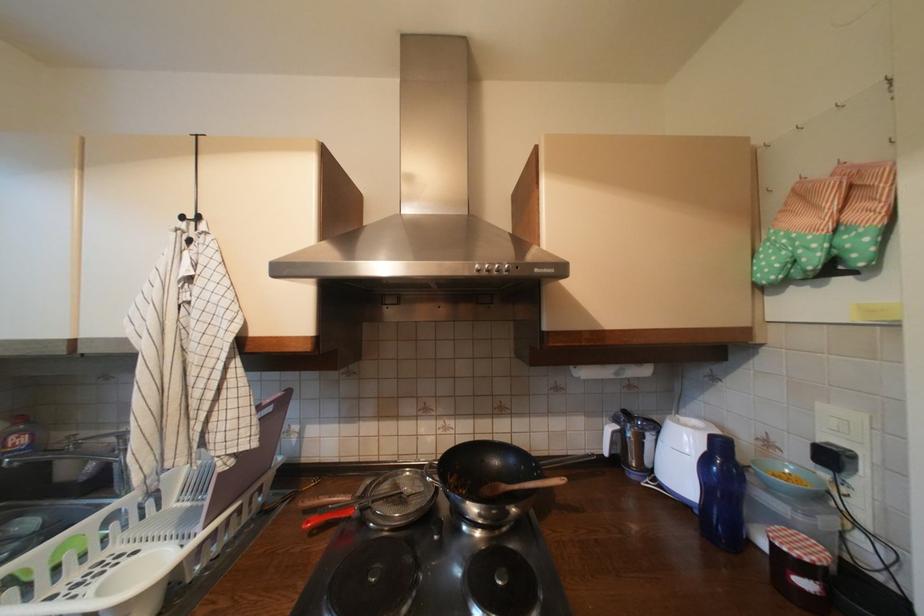
The height and width of the screenshot is (616, 924). Find the location of `green oven mitt`. green oven mitt is located at coordinates (x=800, y=232).